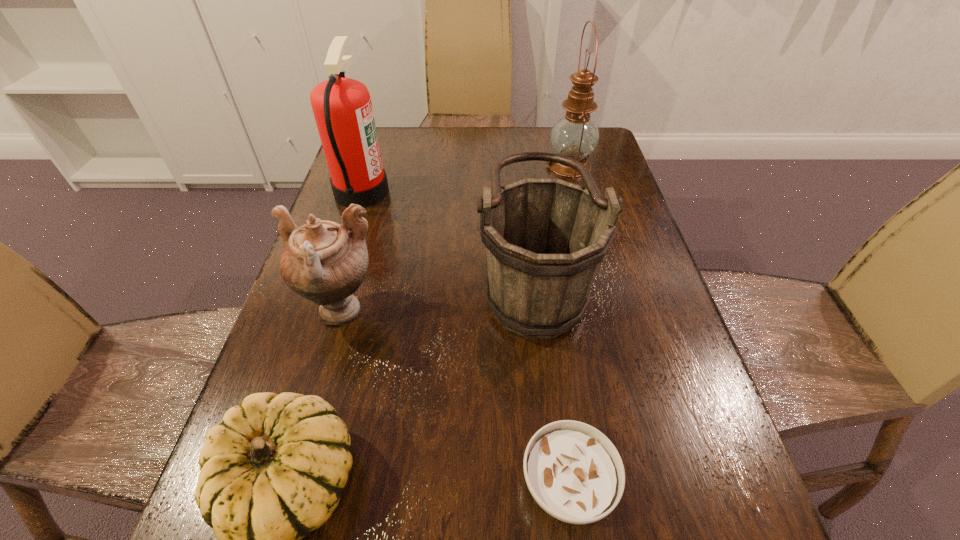
I want to click on free region at the far edge of the desktop, so click(x=416, y=152).

Where is `vacant space at the left edge of the desktop`? This screenshot has width=960, height=540. vacant space at the left edge of the desktop is located at coordinates (366, 295).

Find the location of a particular element. This screenshot has height=540, width=960. vacant space at the right edge is located at coordinates (660, 372).

Locate an element on the screen. free space between the oil lamp and the fire extinguisher is located at coordinates (466, 179).

Where is `vacant area that lies between the bucket and the shortest object`? This screenshot has height=540, width=960. vacant area that lies between the bucket and the shortest object is located at coordinates (550, 383).

Find the location of `free space that is in between the oil lamp and the fire extinguisher`. free space that is in between the oil lamp and the fire extinguisher is located at coordinates (466, 179).

Locate an element on the screen. This screenshot has width=960, height=540. the fifth closest object to the fire extinguisher is located at coordinates (573, 471).

Identify the location of object that stands as the third closest to the gourd. (573, 471).

This screenshot has width=960, height=540. I want to click on free region that satisfies the following two spatial constraints: 1. at the nozzle of the urn; 2. on the right side of the fire extinguisher, so click(x=324, y=312).

At what (x,y) coordinates should I click in order to perform the action: click on free spot that satisfies the following two spatial constraints: 1. on the front side of the shortest object; 2. on the right side of the urn. Please return your answer as a coordinate pair (x, y). Image resolution: width=960 pixels, height=540 pixels. Looking at the image, I should click on (x=291, y=484).